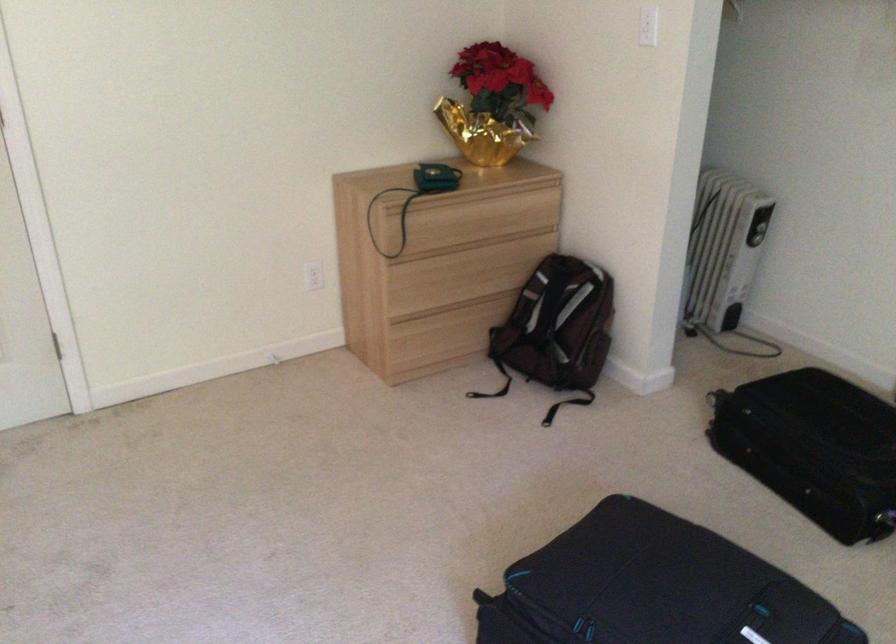
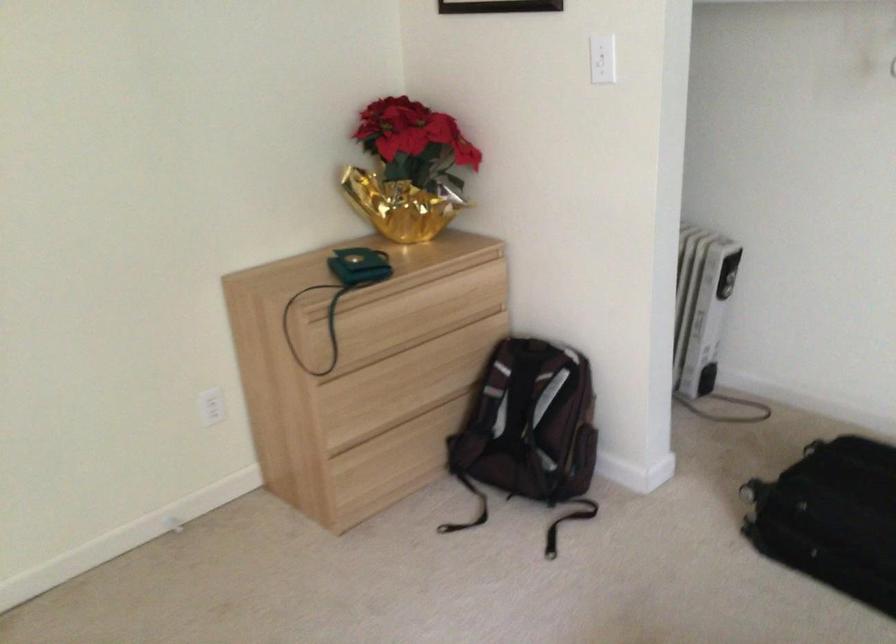
Find the pixel in the second image that matches pixel 762 422 in the first image.

(831, 518)